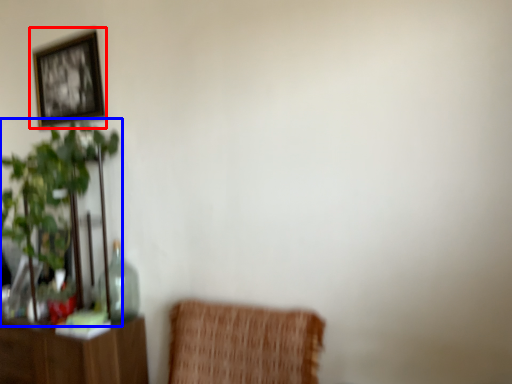
Question: Which object is further to the camera taking this photo, picture frame (highlighted by a red box) or houseplant (highlighted by a blue box)?

Choices:
 (A) picture frame
 (B) houseplant

Answer: (A)